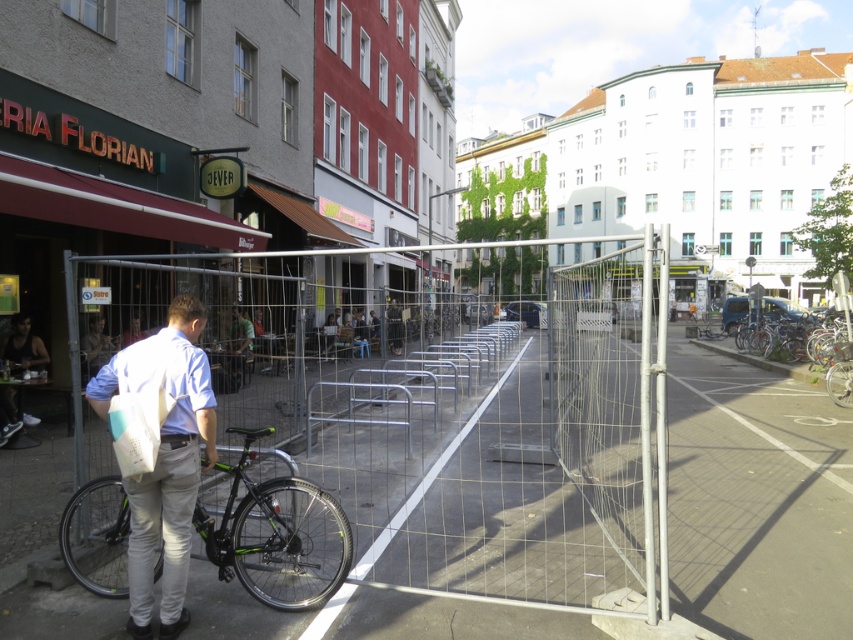
From the picture: Between white fabric bag at left and matte black jacket at left, which one has less height?

With less height is matte black jacket at left.

Find the location of a particular element. white fabric bag at left is located at coordinates (164, 460).

At what (x,y) coordinates should I click in order to perform the action: click on white fabric bag at left. Please return your answer as a coordinate pair (x, y). Looking at the image, I should click on (164, 460).

Is wire mesh fence at center wider than green matte bicycle at left?

Correct, the width of wire mesh fence at center exceeds that of green matte bicycle at left.

Who is lower down, wire mesh fence at center or green matte bicycle at left?

green matte bicycle at left is lower down.

What do you see at coordinates (440, 442) in the screenshot? I see `wire mesh fence at center` at bounding box center [440, 442].

In order to click on wire mesh fence at center in this screenshot , I will do `click(440, 442)`.

This screenshot has width=853, height=640. What do you see at coordinates (440, 442) in the screenshot?
I see `wire mesh fence at center` at bounding box center [440, 442].

Is wire mesh fence at center bigger than white fabric bag at left?

Yes.

Who is more forward, (506, 580) or (85, 390)?

Point (85, 390)

Locate an element on the screen. wire mesh fence at center is located at coordinates (440, 442).